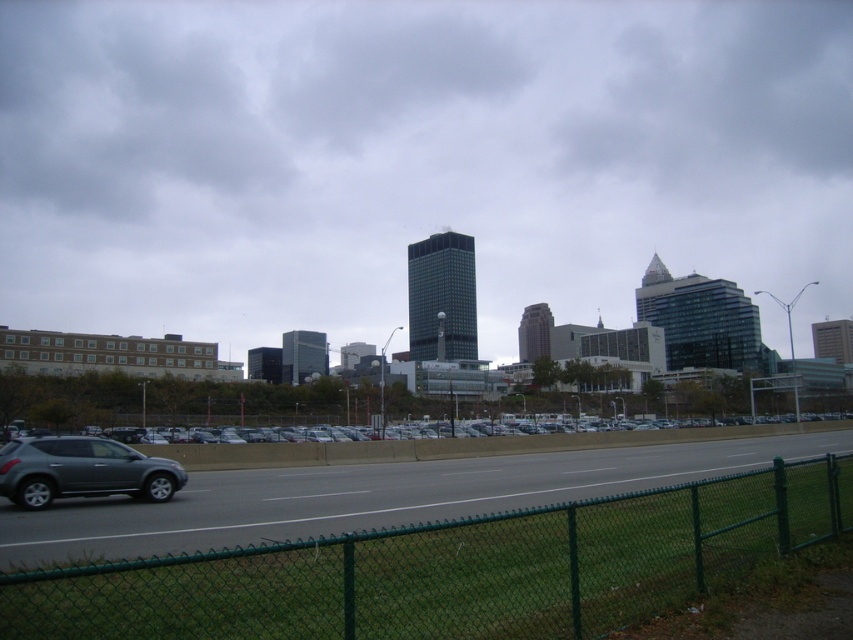
You are standing in the urban landscape scene and want to walk from point A to point B. Point A is located at point (88, 294) and point B is at point (96, 458). Since you can only move forward, which direction should you face to reach point B without moving backward?

You should face towards the direction away from the viewer because point (88, 294) is closer to you than point (96, 458). Moving forward in that direction will take you towards point B.